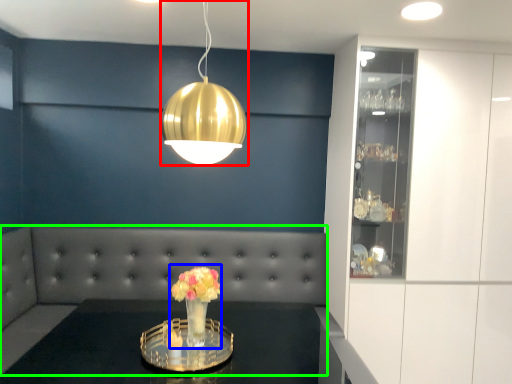
Question: Considering the real-world distances, which object is closest to lamp (highlighted by a red box)? floral arrangement (highlighted by a blue box) or couch (highlighted by a green box).

Choices:
 (A) floral arrangement
 (B) couch

Answer: (A)